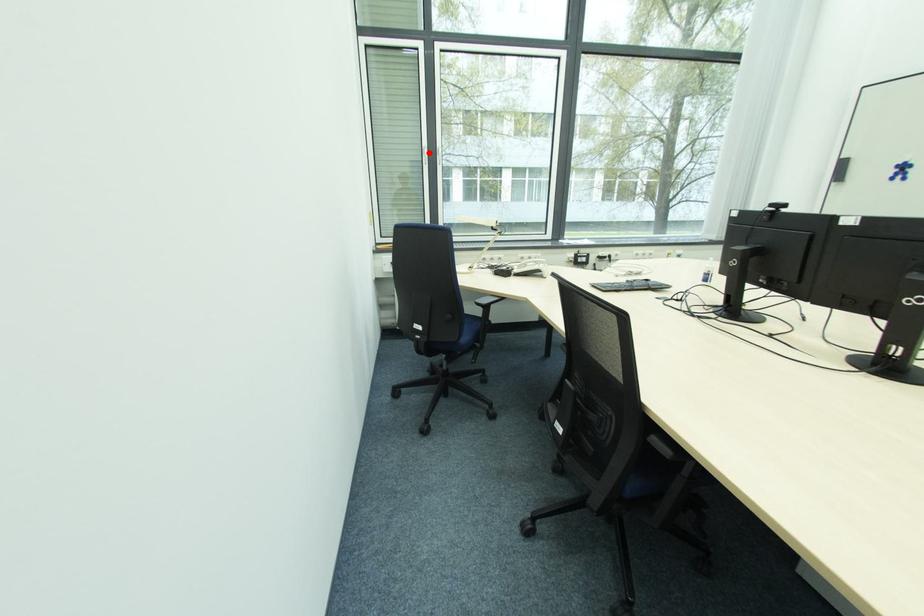
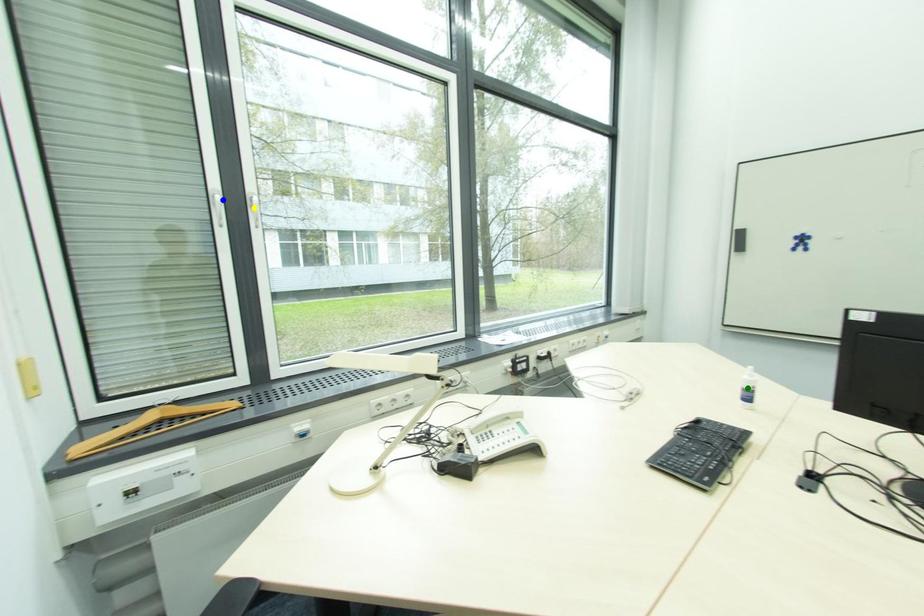
Question: I am providing you with two images of the same scene from different viewpoints. A red point is marked on the first image. You are given multiple points on the second image. Which spot in image 2 lines up with the point in image 1?

Choices:
 (A) blue point
 (B) yellow point
 (C) green point

Answer: (A)